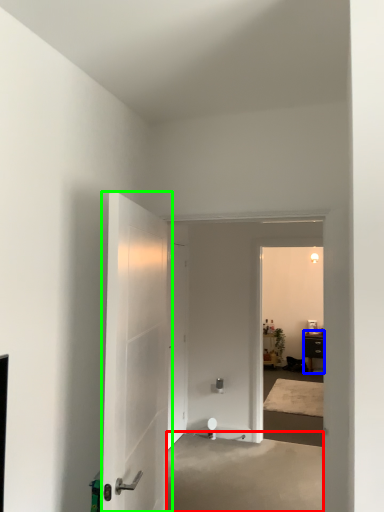
Question: Based on their relative distances, which object is farther from concrete (highlighted by a red box)? Choose from furniture (highlighted by a blue box) and door (highlighted by a green box).

Choices:
 (A) furniture
 (B) door

Answer: (A)